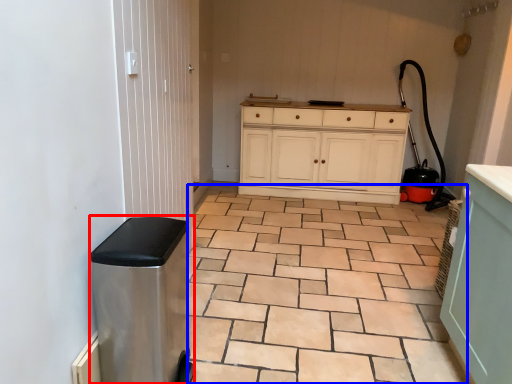
Question: Among these objects, which one is farthest to the camera, water heater (highlighted by a red box) or ceramic tile (highlighted by a blue box)?

Choices:
 (A) water heater
 (B) ceramic tile

Answer: (B)